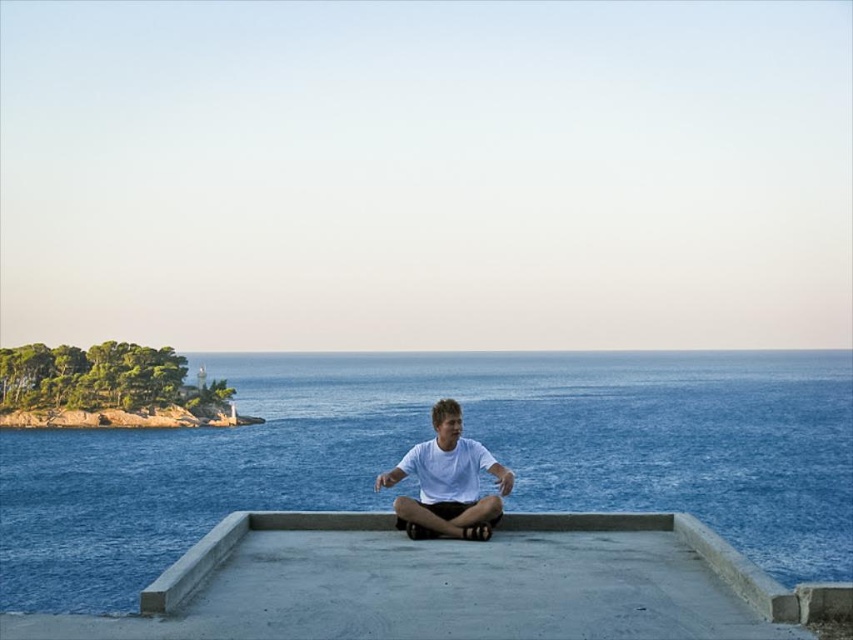
You are standing on the concrete platform and want to place a small basket between the blue water at center and the white matte shirt at center. Which object should you place it closer to if you want the basket to be as far as possible from the water?

You should place the basket closer to the white matte shirt at center because the blue water at center is wider than the white matte shirt at center, so the shirt is narrower and the distance from the water would be maximized by positioning it near the shirt.

You are standing on the concrete at center and want to move to the blue water at center. Which direction should you move in?

The blue water at center is to the right of concrete at center, so you should move to the right to reach it.